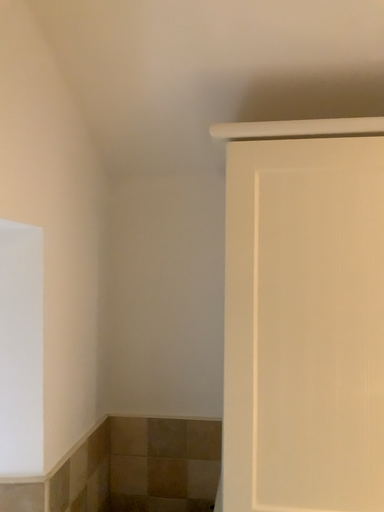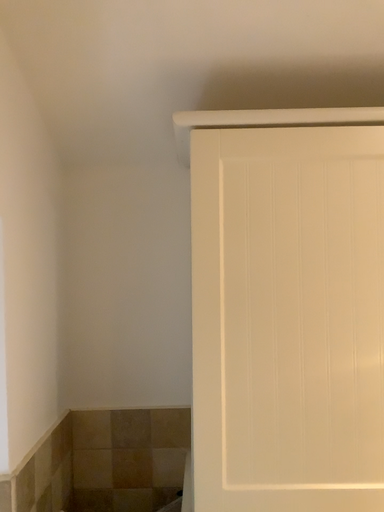
Question: How did the camera likely rotate when shooting the video?

Choices:
 (A) rotated left
 (B) rotated right

Answer: (B)